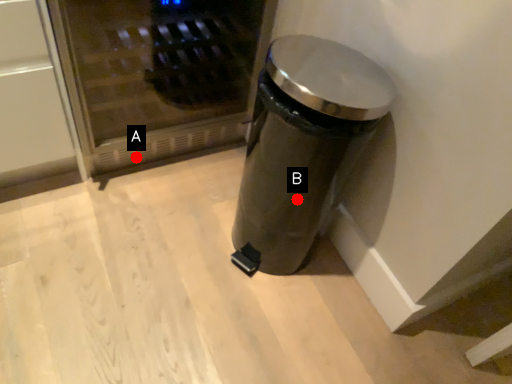
Question: Two points are circled on the image, labeled by A and B beside each circle. Which point is closer to the camera?

Choices:
 (A) A is closer
 (B) B is closer

Answer: (B)